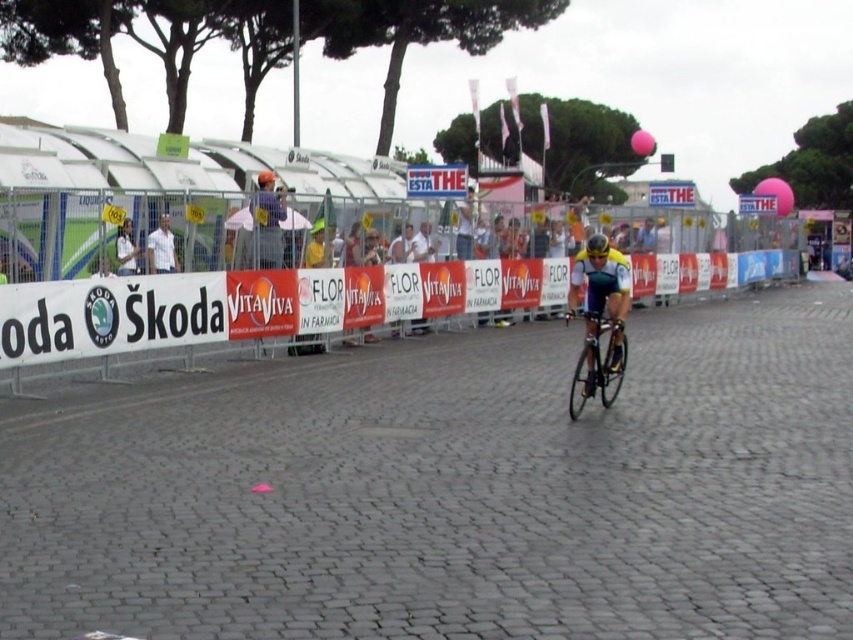
You are a photographer standing at the starting line of the cycling event. You want to take a photo that includes both the black asphalt road at center and the white fabric shirt at left. Based on their positions, which object should appear lower in the photo?

The black asphalt road at center appears lower in the photo because it is located below the white fabric shirt at left according to the description.

You are a photographer trying to capture the cyclist in the center of your photo. The shiny metallic bicycle at center and the yellow matte bicycle helmet at center are both in your frame. Which object should you adjust your camera to focus on if you want the cyclist to be centered?

The shiny metallic bicycle at center is positioned on the left side of yellow matte bicycle helmet at center. To center the cyclist, focus on the yellow matte bicycle helmet at center since it is closer to the center point of the frame.

You are a photographer standing at the center of the image. You want to take a photo of the cyclist in motion and the white shirt at left. Based on their positions, which object is closer to your current position?

The white shirt at left is closer to your current position because it is located at point (161, 248), which is nearer to the center compared to the cyclist positioned off to the right.